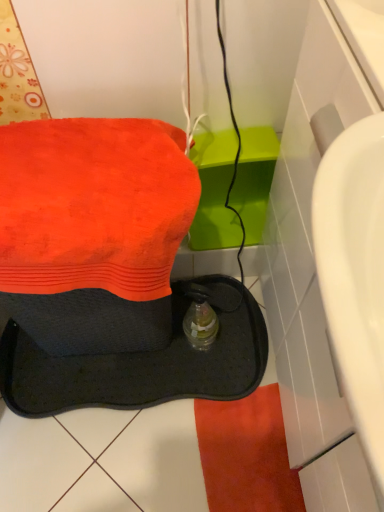
The height and width of the screenshot is (512, 384). Identify the location of orange terry towel at upper left. (93, 205).

I want to click on black rubber sink at lower left, so click(x=140, y=362).

Considering the positions of objects black rubber sink at lower left and translucent plastic bottle at center in the image provided, who is more to the right, black rubber sink at lower left or translucent plastic bottle at center?

Positioned to the right is translucent plastic bottle at center.

Which of these two, black rubber sink at lower left or translucent plastic bottle at center, is smaller?

Smaller between the two is translucent plastic bottle at center.

Considering the positions of point (56, 400) and point (204, 324), is point (56, 400) closer or farther from the camera than point (204, 324)?

Point (56, 400) is farther from the camera than point (204, 324).

Measure the distance between black rubber sink at lower left and translucent plastic bottle at center.

The distance of black rubber sink at lower left from translucent plastic bottle at center is 6.39 inches.

Is translucent plastic bottle at center inside the boundaries of black rubber sink at lower left, or outside?

translucent plastic bottle at center can be found inside black rubber sink at lower left.

From the image's perspective, which is below, translucent plastic bottle at center or black rubber sink at lower left?

From the image's view, translucent plastic bottle at center is below.

Is translucent plastic bottle at center positioned with its back to black rubber sink at lower left?

Yes, translucent plastic bottle at center is facing away from black rubber sink at lower left.

Does black rubber sink at lower left lie behind orange terry towel at upper left?

No, the depth of black rubber sink at lower left is less than that of orange terry towel at upper left.

Consider the image. From the image's perspective, which one is positioned higher, black rubber sink at lower left or orange terry towel at upper left?

From the image's view, orange terry towel at upper left is above.

Is point (199, 195) behind point (46, 292)?

Yes, it is behind point (46, 292).

Considering the sizes of objects black rubber sink at lower left and orange terry towel at upper left in the image provided, who is bigger, black rubber sink at lower left or orange terry towel at upper left?

With larger size is black rubber sink at lower left.

Can you tell me how much orange terry towel at upper left and black rubber sink at lower left differ in facing direction?

0.000183 degrees.

Is orange terry towel at upper left looking in the opposite direction of black rubber sink at lower left?

Yes.

In the scene shown: Which is more to the left, orange terry towel at upper left or black rubber sink at lower left?

Positioned to the left is black rubber sink at lower left.

From the image's perspective, would you say orange terry towel at upper left is shown under black rubber sink at lower left?

→ Actually, orange terry towel at upper left appears above black rubber sink at lower left in the image.

Is the position of orange terry towel at upper left more distant than that of translucent plastic bottle at center?

No, orange terry towel at upper left is closer to the viewer.

Looking at this image, from the image's perspective, would you say orange terry towel at upper left is shown under translucent plastic bottle at center?

No, from the image's perspective, orange terry towel at upper left is not beneath translucent plastic bottle at center.

Is orange terry towel at upper left positioned far away from translucent plastic bottle at center?

That's not correct — orange terry towel at upper left is a little close to translucent plastic bottle at center.

Is orange terry towel at upper left at the right side of translucent plastic bottle at center?

No, orange terry towel at upper left is not to the right of translucent plastic bottle at center.

From a real-world perspective, which is physically below, translucent plastic bottle at center or orange terry towel at upper left?

translucent plastic bottle at center, from a real-world perspective.

Does translucent plastic bottle at center have a lesser height compared to orange terry towel at upper left?

No.

From the image's perspective, which one is positioned lower, translucent plastic bottle at center or orange terry towel at upper left?

From the image's view, translucent plastic bottle at center is below.

Where is `bottle below the black rubber sink at lower left (from a real-world perspective)`? The width and height of the screenshot is (384, 512). bottle below the black rubber sink at lower left (from a real-world perspective) is located at coordinates (200, 325).

Identify the location of bottle that appears behind the black rubber sink at lower left. (200, 325).

Looking at the image, which one is located closer to translucent plastic bottle at center, orange terry towel at upper left or black rubber sink at lower left?

black rubber sink at lower left lies closer to translucent plastic bottle at center than the other object.

Looking at the image, which one is located closer to black rubber sink at lower left, translucent plastic bottle at center or orange terry towel at upper left?

Among the two, translucent plastic bottle at center is located nearer to black rubber sink at lower left.

Based on their spatial positions, is black rubber sink at lower left or translucent plastic bottle at center further from orange terry towel at upper left?

Among the two, black rubber sink at lower left is located further to orange terry towel at upper left.

Which object lies further to the anchor point orange terry towel at upper left, translucent plastic bottle at center or black rubber sink at lower left?

black rubber sink at lower left lies further to orange terry towel at upper left than the other object.

Estimate the real-world distances between objects in this image. Which object is further from translucent plastic bottle at center, black rubber sink at lower left or orange terry towel at upper left?

orange terry towel at upper left lies further to translucent plastic bottle at center than the other object.

Based on their spatial positions, is orange terry towel at upper left or translucent plastic bottle at center closer to black rubber sink at lower left?

translucent plastic bottle at center is positioned closer to the anchor black rubber sink at lower left.

The image size is (384, 512). What are the coordinates of `towel positioned between black rubber sink at lower left and translucent plastic bottle at center from near to far` in the screenshot? It's located at (93, 205).